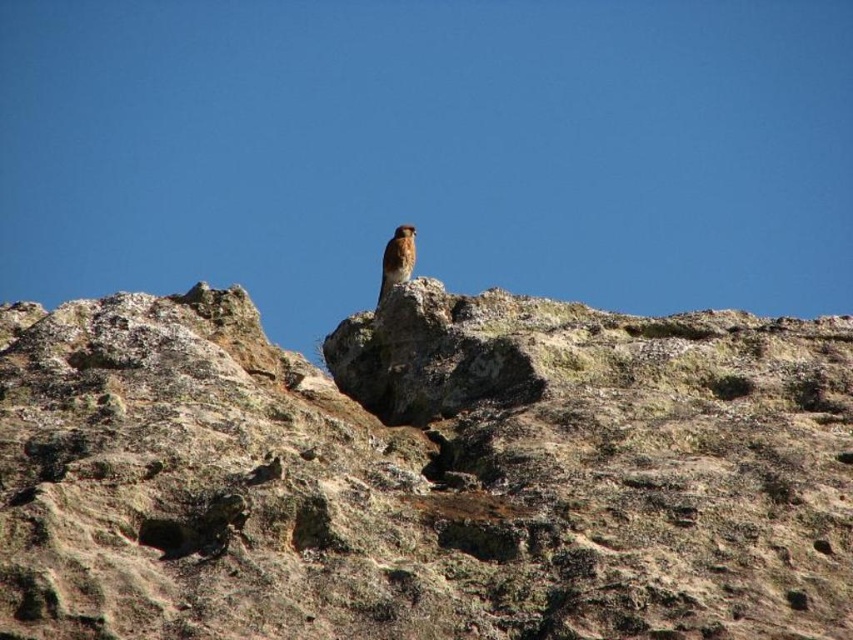
Question: Does brown rough rock at upper center appear on the right side of rusty brown feathers at center?

Choices:
 (A) no
 (B) yes

Answer: (B)

Question: Is brown rough rock at upper center to the left of rusty brown feathers at center from the viewer's perspective?

Choices:
 (A) no
 (B) yes

Answer: (A)

Question: Considering the relative positions of brown rough rock at upper center and rusty brown feathers at center in the image provided, where is brown rough rock at upper center located with respect to rusty brown feathers at center?

Choices:
 (A) below
 (B) above

Answer: (A)

Question: Among these objects, which one is farthest from the camera?

Choices:
 (A) brown rough rock at upper center
 (B) rusty brown feathers at center

Answer: (B)